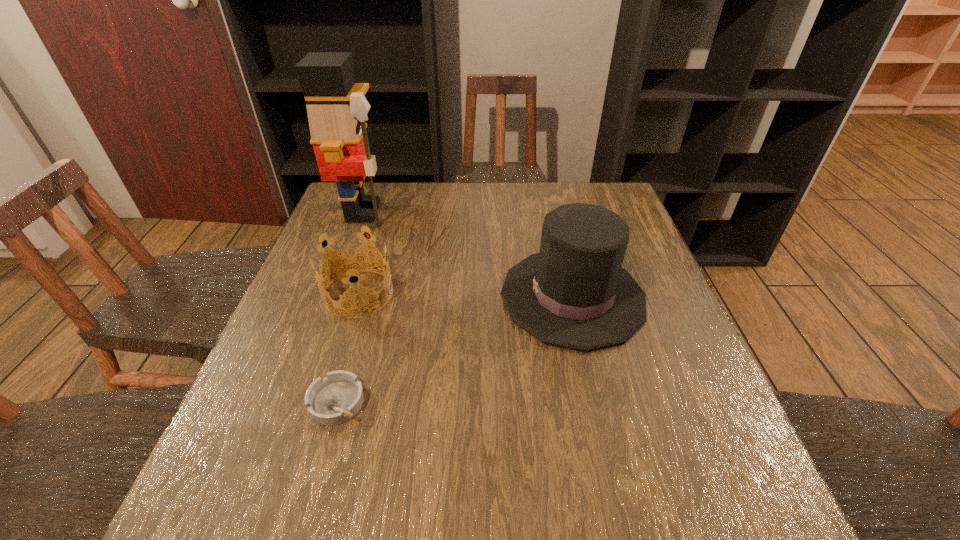
The width and height of the screenshot is (960, 540). Find the location of `free location that satisfies the following two spatial constraints: 1. in front of the farthest object holding the staff; 2. on the left side of the ashtray`. free location that satisfies the following two spatial constraints: 1. in front of the farthest object holding the staff; 2. on the left side of the ashtray is located at coordinates (294, 402).

The image size is (960, 540). I want to click on vacant region that satisfies the following two spatial constraints: 1. in front of the nearest object holding the staff; 2. on the right side of the tallest object, so click(x=294, y=402).